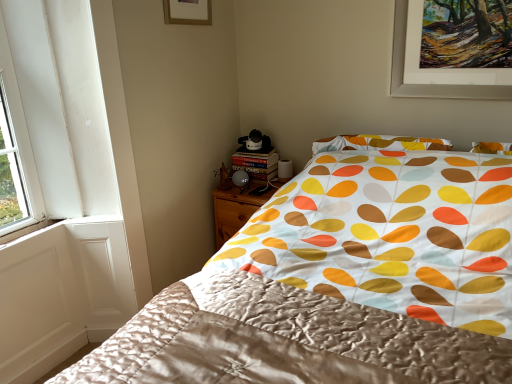
Question: Is matte gold picture frame at upper center turned away from wooden nightstand at lower center?

Choices:
 (A) no
 (B) yes

Answer: (A)

Question: Considering the relative sizes of matte gold picture frame at upper center and wooden nightstand at lower center in the image provided, is matte gold picture frame at upper center bigger than wooden nightstand at lower center?

Choices:
 (A) no
 (B) yes

Answer: (A)

Question: From the image's perspective, is matte gold picture frame at upper center above wooden nightstand at lower center?

Choices:
 (A) no
 (B) yes

Answer: (B)

Question: Does matte gold picture frame at upper center come behind wooden nightstand at lower center?

Choices:
 (A) yes
 (B) no

Answer: (B)

Question: Is matte gold picture frame at upper center oriented towards wooden nightstand at lower center?

Choices:
 (A) yes
 (B) no

Answer: (B)

Question: From a real-world perspective, is matte gold picture frame at upper center physically above wooden nightstand at lower center?

Choices:
 (A) no
 (B) yes

Answer: (B)

Question: Does silky satin blanket at center have a greater width compared to silky fabric bed at center?

Choices:
 (A) yes
 (B) no

Answer: (B)

Question: Does silky satin blanket at center appear on the right side of silky fabric bed at center?

Choices:
 (A) yes
 (B) no

Answer: (B)

Question: Is silky satin blanket at center positioned beyond the bounds of silky fabric bed at center?

Choices:
 (A) yes
 (B) no

Answer: (B)

Question: From the image's perspective, would you say silky satin blanket at center is shown under silky fabric bed at center?

Choices:
 (A) no
 (B) yes

Answer: (B)

Question: Is silky satin blanket at center closer to camera compared to silky fabric bed at center?

Choices:
 (A) yes
 (B) no

Answer: (B)

Question: Is silky satin blanket at center at the left side of silky fabric bed at center?

Choices:
 (A) no
 (B) yes

Answer: (B)

Question: Is silky fabric bed at center next to silky satin blanket at center and touching it?

Choices:
 (A) no
 (B) yes

Answer: (A)